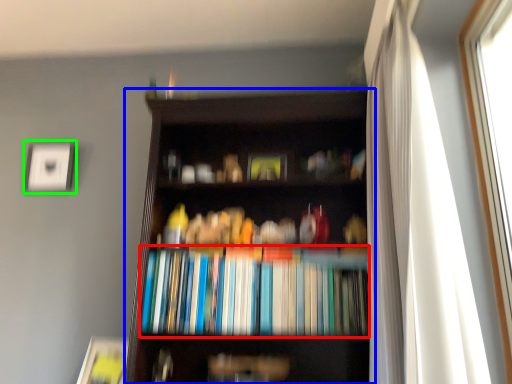
Question: Which object is positioned closest to book (highlighted by a red box)? Select from bookcase (highlighted by a blue box) and picture frame (highlighted by a green box).

Choices:
 (A) bookcase
 (B) picture frame

Answer: (A)